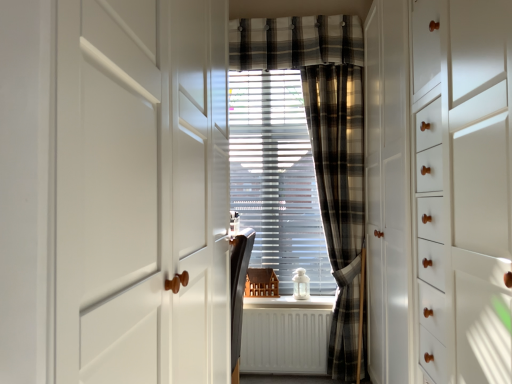
Question: Is plaid fabric curtain at center looking in the opposite direction of white matte radiator at center?

Choices:
 (A) yes
 (B) no

Answer: (B)

Question: Does plaid fabric curtain at center have a greater width compared to white matte radiator at center?

Choices:
 (A) no
 (B) yes

Answer: (B)

Question: Can you confirm if plaid fabric curtain at center is taller than white matte radiator at center?

Choices:
 (A) yes
 (B) no

Answer: (A)

Question: Is plaid fabric curtain at center positioned beyond the bounds of white matte radiator at center?

Choices:
 (A) yes
 (B) no

Answer: (A)

Question: From the image's perspective, is plaid fabric curtain at center located above white matte radiator at center?

Choices:
 (A) yes
 (B) no

Answer: (A)

Question: Looking at their shapes, would you say plaid fabric curtain at center is wider or thinner than white plastic blinds at center?

Choices:
 (A) thin
 (B) wide

Answer: (B)

Question: Based on their positions, is plaid fabric curtain at center located to the left or right of white plastic blinds at center?

Choices:
 (A) left
 (B) right

Answer: (B)

Question: Looking at the image, does plaid fabric curtain at center seem bigger or smaller compared to white plastic blinds at center?

Choices:
 (A) small
 (B) big

Answer: (B)

Question: Is plaid fabric curtain at center inside the boundaries of white plastic blinds at center, or outside?

Choices:
 (A) inside
 (B) outside

Answer: (B)

Question: Is plaid fabric curtain at center situated inside plaid fabric curtain at center or outside?

Choices:
 (A) outside
 (B) inside

Answer: (A)

Question: Looking at their shapes, would you say plaid fabric curtain at center is wider or thinner than plaid fabric curtain at center?

Choices:
 (A) thin
 (B) wide

Answer: (A)

Question: Is point (283, 39) positioned closer to the camera than point (337, 182)?

Choices:
 (A) closer
 (B) farther

Answer: (B)

Question: Is plaid fabric curtain at center taller or shorter than plaid fabric curtain at center?

Choices:
 (A) tall
 (B) short

Answer: (B)

Question: Considering the positions of point (229, 243) and point (331, 299), is point (229, 243) closer or farther from the camera than point (331, 299)?

Choices:
 (A) farther
 (B) closer

Answer: (B)

Question: In terms of size, does matte black chair at center, the first furniture positioned from the front, appear bigger or smaller than white glossy window sill at center?

Choices:
 (A) big
 (B) small

Answer: (A)